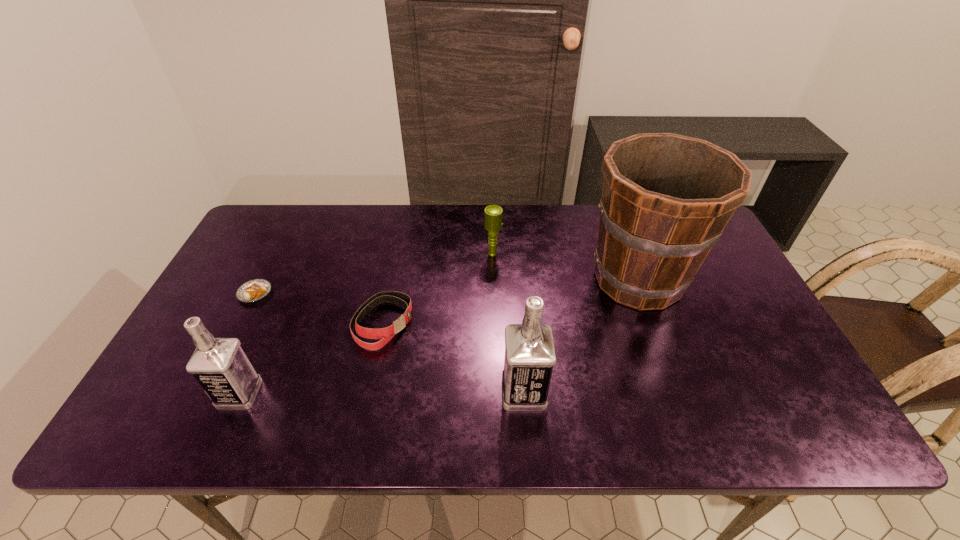
You are a GUI agent. You are given a task and a screenshot of the screen. Output one action in this format:
    pyautogui.click(x=<x>, y=<y>)
    Task: Click on the object that is at the right edge
    
    Given the screenshot: What is the action you would take?
    pyautogui.click(x=666, y=198)

Where is `object that is positioned at the near left corner`? This screenshot has height=540, width=960. object that is positioned at the near left corner is located at coordinates (220, 366).

You are a GUI agent. You are given a task and a screenshot of the screen. Output one action in this format:
    pyautogui.click(x=<x>, y=<y>)
    Task: Click on the object present at the far right corner
    
    Given the screenshot: What is the action you would take?
    pyautogui.click(x=666, y=198)

Where is `free space at the far edge of the desktop`? Image resolution: width=960 pixels, height=540 pixels. free space at the far edge of the desktop is located at coordinates (511, 215).

Identify the location of vacant space at the near edge. The height and width of the screenshot is (540, 960). (300, 396).

Find the location of a particular element. free space at the left edge of the desktop is located at coordinates (228, 279).

Locate an element on the screen. The image size is (960, 540). vacant space at the right edge of the desktop is located at coordinates (729, 360).

The image size is (960, 540). Find the location of `vacant space at the near right corner of the desktop`. vacant space at the near right corner of the desktop is located at coordinates point(780,393).

Find the location of a particular element. Image resolution: width=960 pixels, height=540 pixels. free space between the microphone and the third object from left to right is located at coordinates (438, 289).

The image size is (960, 540). I want to click on free point between the taller vodka and the rightmost object, so click(x=581, y=335).